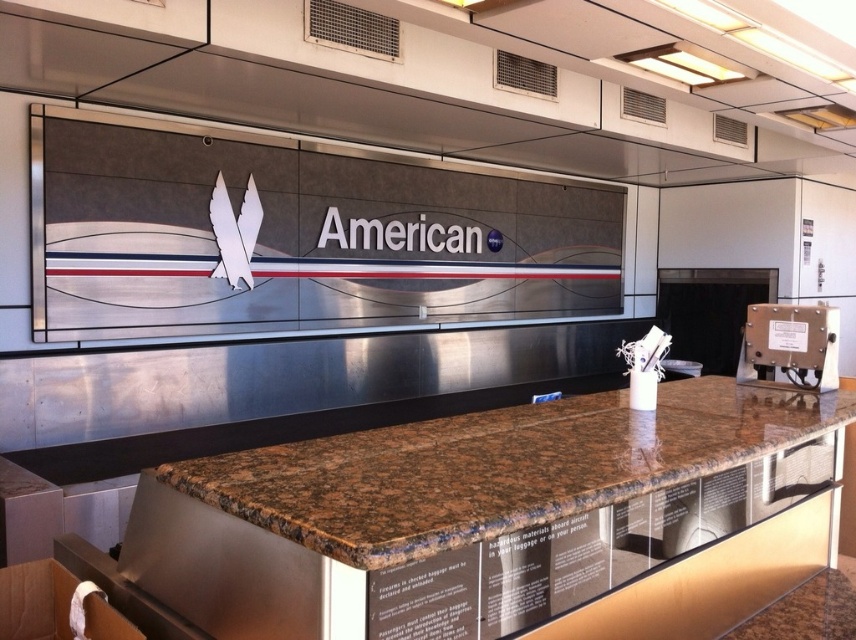
Question: Can you confirm if brown granite counter at center is positioned to the right of white matte wings at center?

Choices:
 (A) no
 (B) yes

Answer: (B)

Question: Which object is positioned farthest from the brown granite counter at center?

Choices:
 (A) white matte wings at center
 (B) metallic silver sign at upper center

Answer: (B)

Question: Estimate the real-world distances between objects in this image. Which object is closer to the white matte wings at center?

Choices:
 (A) brown granite counter at center
 (B) metallic silver sign at upper center

Answer: (B)

Question: Can you confirm if metallic silver sign at upper center is positioned above white matte wings at center?

Choices:
 (A) no
 (B) yes

Answer: (B)

Question: Which point is closer to the camera taking this photo?

Choices:
 (A) (805, 305)
 (B) (91, 333)
 (C) (459, 445)
 (D) (241, 218)

Answer: (C)

Question: Does metallic silver sign at upper center appear on the left side of white matte wings at center?

Choices:
 (A) yes
 (B) no

Answer: (B)